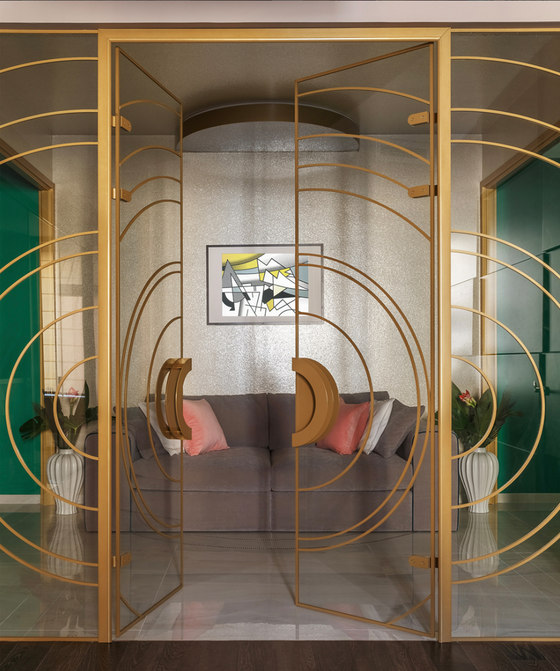
The image size is (560, 671). Identify the location of ceiling ornament. (269, 125).